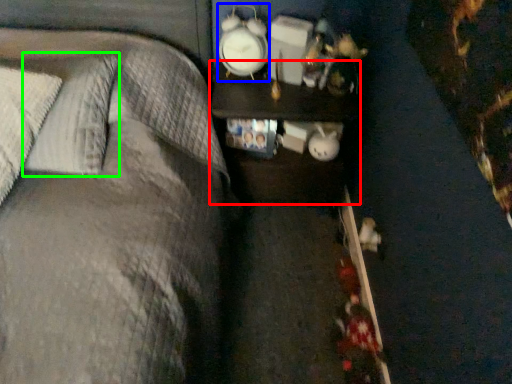
Question: Considering the real-world distances, which object is farthest from nightstand (highlighted by a red box)? clock (highlighted by a blue box) or pillow (highlighted by a green box)?

Choices:
 (A) clock
 (B) pillow

Answer: (B)